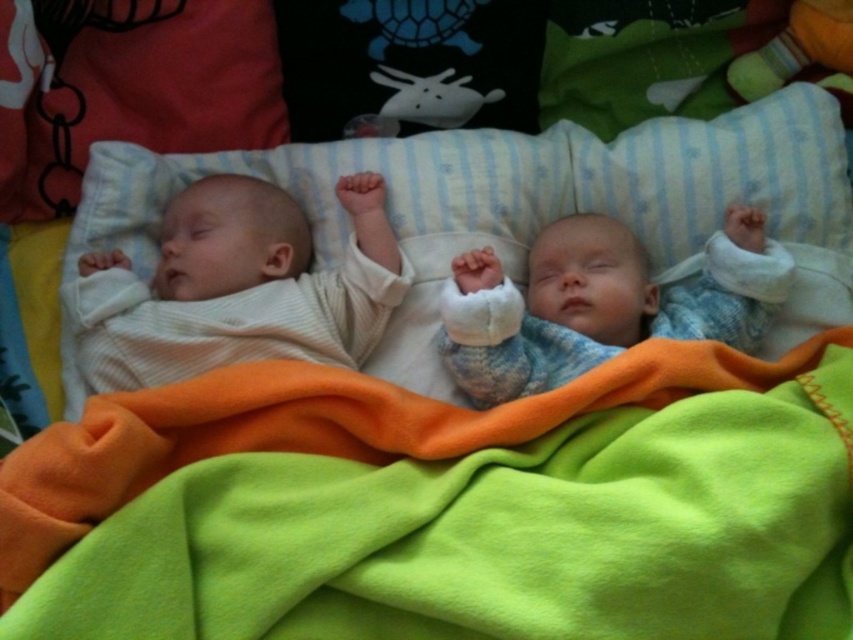
You are a nurse checking on two sleeping babies. The white ribbed fabric baby at left is at position 0.450 on the x axis and 0.279 on the y axis. The other baby is at position 0.550 on the x axis and 0.321 on the y axis. Which baby is closer to the left side of the bed?

The white ribbed fabric baby at left is closer to the left side of the bed because it has a lower x coordinate of 0.450 compared to the other baby at 0.550.

You are a parent checking on your sleeping babies. You see the green fleece blanket at lower center and the white ribbed fabric baby at left. Which object is positioned to the right of the other?

The green fleece blanket at lower center is to the right of the white ribbed fabric baby at left.